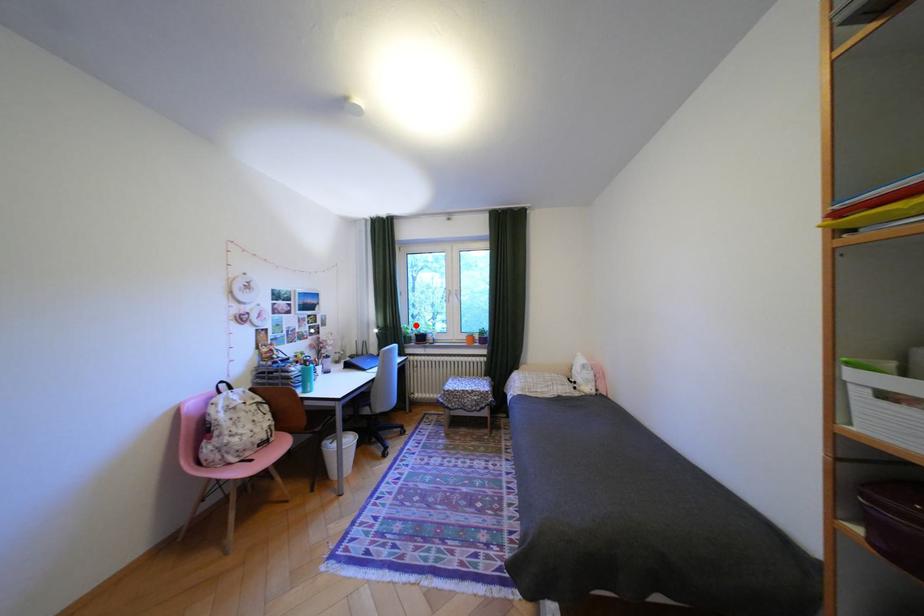
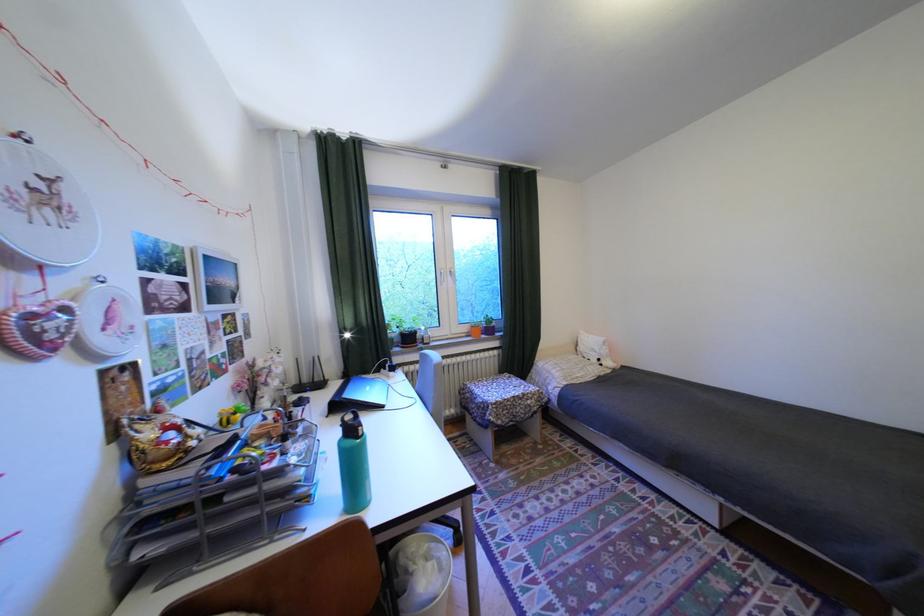
Question: I am providing you with two images of the same scene from different viewpoints. Image1 has a red point marked. In image2, the corresponding 3D location appears at what relative position? Reply with the corresponding letter.

Choices:
 (A) Closer
 (B) Farther

Answer: (B)